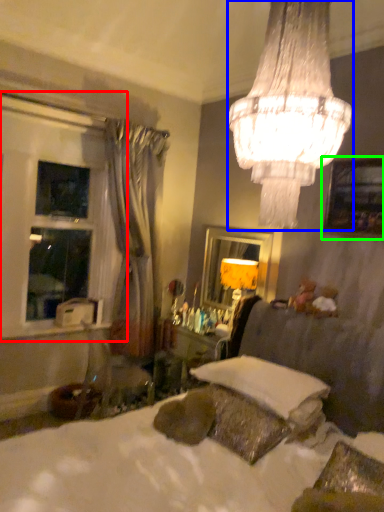
Question: Which object is the farthest from bay window (highlighted by a red box)? Choose among these: lamp (highlighted by a blue box) or picture frame (highlighted by a green box).

Choices:
 (A) lamp
 (B) picture frame

Answer: (A)